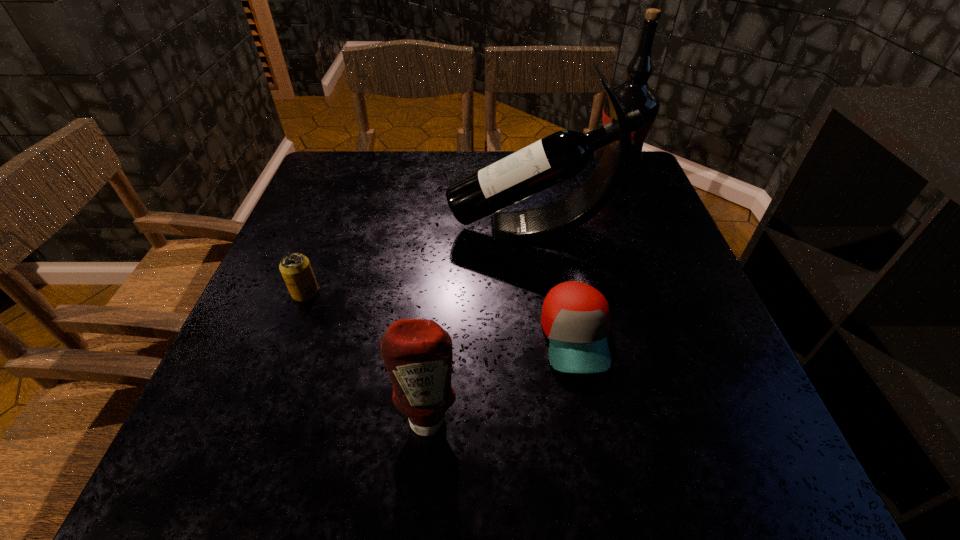
The image size is (960, 540). Find the location of `the farther wine bottle`. the farther wine bottle is located at coordinates pos(635,93).

Locate an element on the screen. the nearer wine bottle is located at coordinates (562, 155).

This screenshot has height=540, width=960. Find the location of `the nearest object`. the nearest object is located at coordinates (418, 356).

At what (x,y) coordinates should I click in order to perform the action: click on condiment. Please return your answer as a coordinate pair (x, y). The image size is (960, 540). Looking at the image, I should click on (418, 356).

Locate an element on the screen. The image size is (960, 540). the leftmost object is located at coordinates (295, 268).

This screenshot has height=540, width=960. In order to click on beer can in this screenshot , I will do `click(295, 268)`.

Locate an element on the screen. This screenshot has width=960, height=540. baseball cap is located at coordinates (575, 317).

Where is `free space located on the left of the farther wine bottle`? The height and width of the screenshot is (540, 960). free space located on the left of the farther wine bottle is located at coordinates (529, 166).

At what (x,y) coordinates should I click in order to perform the action: click on free spot located on the stand of the second farthest object. Please return your answer as a coordinate pair (x, y). This screenshot has height=540, width=960. Looking at the image, I should click on (369, 230).

I want to click on free space located 0.350m on the stand of the second farthest object, so click(x=301, y=230).